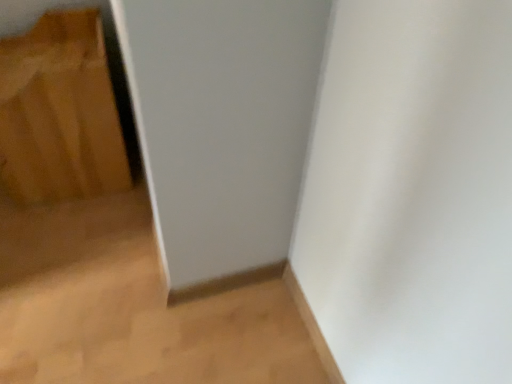
This screenshot has height=384, width=512. I want to click on brown cardboard at upper left, so click(60, 112).

What do you see at coordinates (60, 112) in the screenshot? The width and height of the screenshot is (512, 384). I see `brown cardboard at upper left` at bounding box center [60, 112].

Identify the location of brown cardboard at upper left. (60, 112).